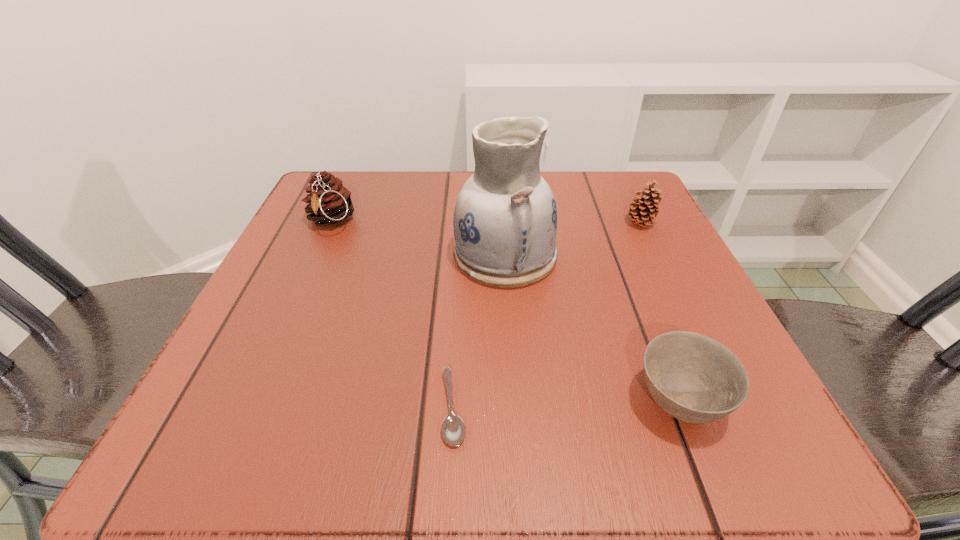
The width and height of the screenshot is (960, 540). Find the location of `the tallest object`. the tallest object is located at coordinates (505, 220).

The image size is (960, 540). What are the coordinates of `the leftmost object` in the screenshot? It's located at (329, 202).

I want to click on the shorter pinecone, so click(643, 214).

At what (x,y) coordinates should I click in order to perform the action: click on the right pinecone. Please return your answer as a coordinate pair (x, y). The width and height of the screenshot is (960, 540). Looking at the image, I should click on (643, 214).

Image resolution: width=960 pixels, height=540 pixels. What are the coordinates of `the second shortest object` in the screenshot? It's located at (694, 378).

Where is `the shortest object`? This screenshot has height=540, width=960. the shortest object is located at coordinates (453, 429).

This screenshot has width=960, height=540. Find the location of `vacant space located on the back of the pottery`. vacant space located on the back of the pottery is located at coordinates (502, 208).

The height and width of the screenshot is (540, 960). I want to click on free space located with a leaf charm attached to the leftmost object, so click(x=300, y=288).

Locate an element on the screen. Image resolution: width=960 pixels, height=540 pixels. vacant area situated on the left of the third shortest object is located at coordinates (556, 223).

The width and height of the screenshot is (960, 540). I want to click on free space located on the back of the bowl, so click(x=609, y=221).